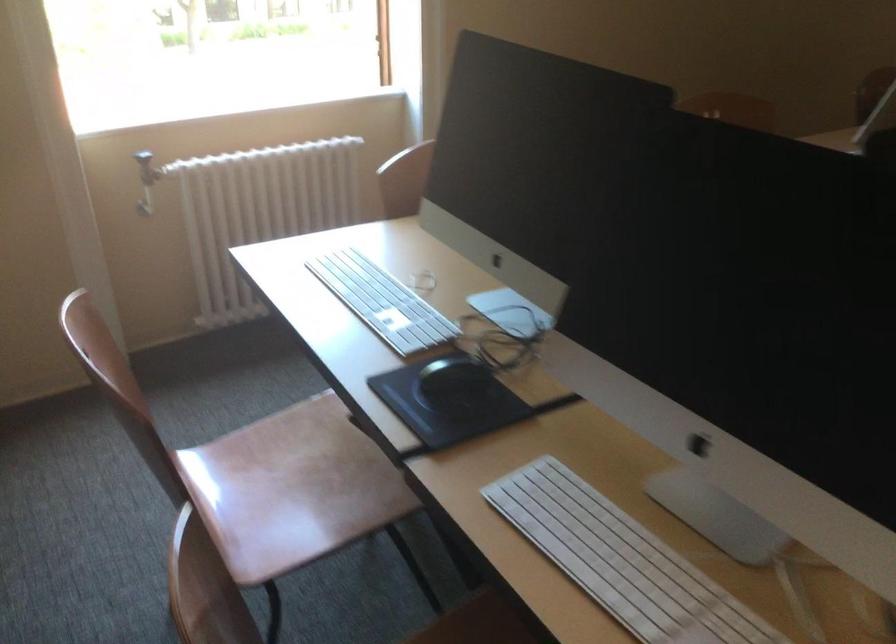
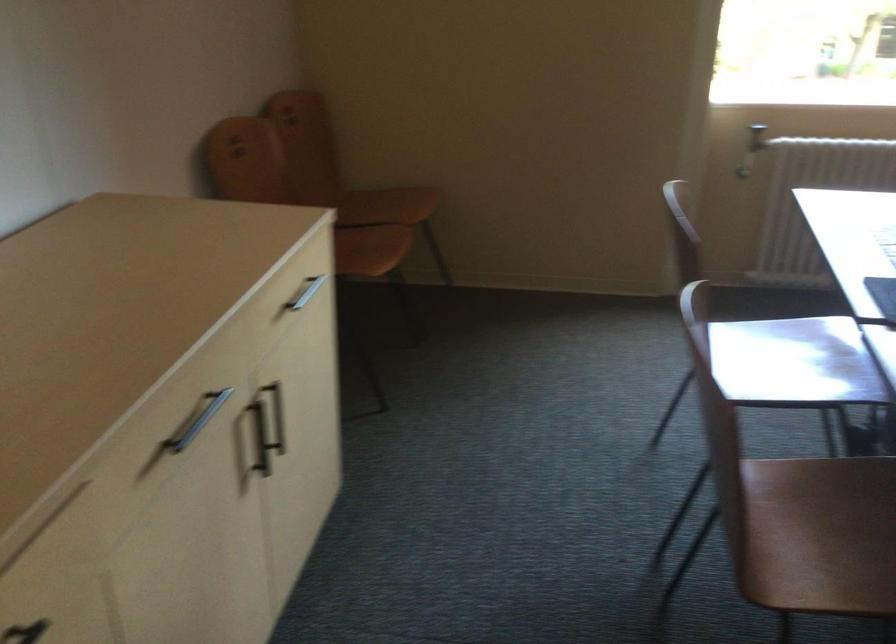
Locate, in the second image, the point that corresponds to [174,223] in the first image.

(743, 172)